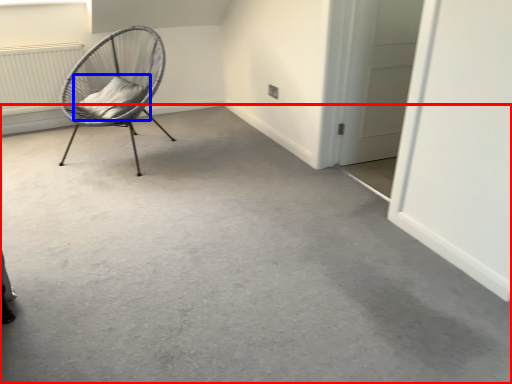
Question: Which point is closer to the camera, concrete (highlighted by a red box) or pillow (highlighted by a blue box)?

Choices:
 (A) concrete
 (B) pillow

Answer: (A)